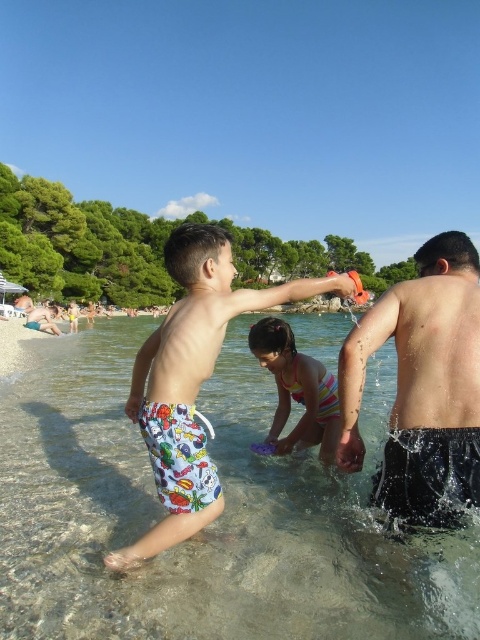
Is clear water at center closer to camera compared to striped swimsuit at center?

Yes, it is.

Does clear water at center have a lesser height compared to striped swimsuit at center?

Indeed, clear water at center has a lesser height compared to striped swimsuit at center.

Which is behind, point (90, 413) or point (325, 384)?

Positioned behind is point (90, 413).

At what (x,y) coordinates should I click in order to perform the action: click on clear water at center. Please return your answer as a coordinate pair (x, y). The image size is (480, 640). Looking at the image, I should click on (212, 524).

In the scene shown: Can you confirm if printed swim trunks at center is positioned to the left of striped swimsuit at center?

Correct, you'll find printed swim trunks at center to the left of striped swimsuit at center.

Can you confirm if printed swim trunks at center is thinner than striped swimsuit at center?

No.

From the picture: Who is more distant from viewer, (193, 384) or (324, 444)?

The point (324, 444) is behind.

Find the location of `printed swim trunks at center`. printed swim trunks at center is located at coordinates (192, 380).

Does clear water at center appear on the right side of printed swim trunks at center?

Correct, you'll find clear water at center to the right of printed swim trunks at center.

From the picture: Does clear water at center lie behind printed swim trunks at center?

No, clear water at center is closer to the viewer.

Is point (416, 538) positioned behind point (202, 515)?

That is False.

Find the location of a particular element. This screenshot has height=640, width=480. clear water at center is located at coordinates (212, 524).